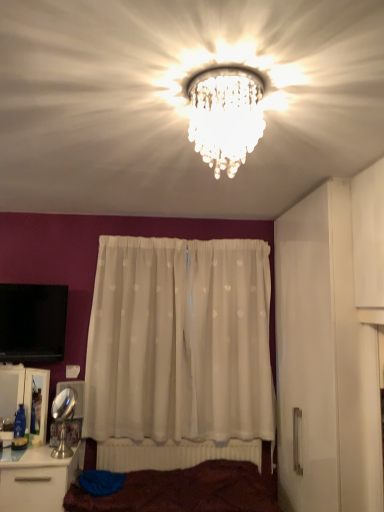
Question: Visually, is white plastic radiator at lower center positioned to the left or to the right of clear crystal chandelier at center?

Choices:
 (A) right
 (B) left

Answer: (B)

Question: In terms of width, does white plastic radiator at lower center look wider or thinner when compared to clear crystal chandelier at center?

Choices:
 (A) wide
 (B) thin

Answer: (B)

Question: Based on their relative distances, which object is farther from the white glossy cabinet at lower left?

Choices:
 (A) black glossy television at left
 (B) white sheer curtain at center
 (C) white plastic radiator at lower center
 (D) clear crystal chandelier at center
 (E) brown fabric bed at lower center

Answer: (D)

Question: Estimate the real-world distances between objects in this image. Which object is closer to the white glossy cabinet at lower left?

Choices:
 (A) clear crystal chandelier at center
 (B) white sheer curtain at center
 (C) white plastic radiator at lower center
 (D) black glossy television at left
 (E) brown fabric bed at lower center

Answer: (D)